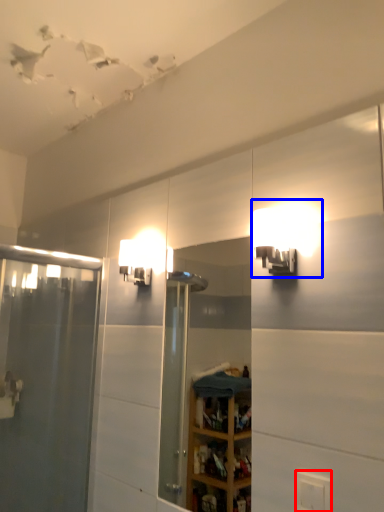
Question: Which object appears farthest to the camera in this image, electric outlet (highlighted by a red box) or light fixture (highlighted by a blue box)?

Choices:
 (A) electric outlet
 (B) light fixture

Answer: (B)